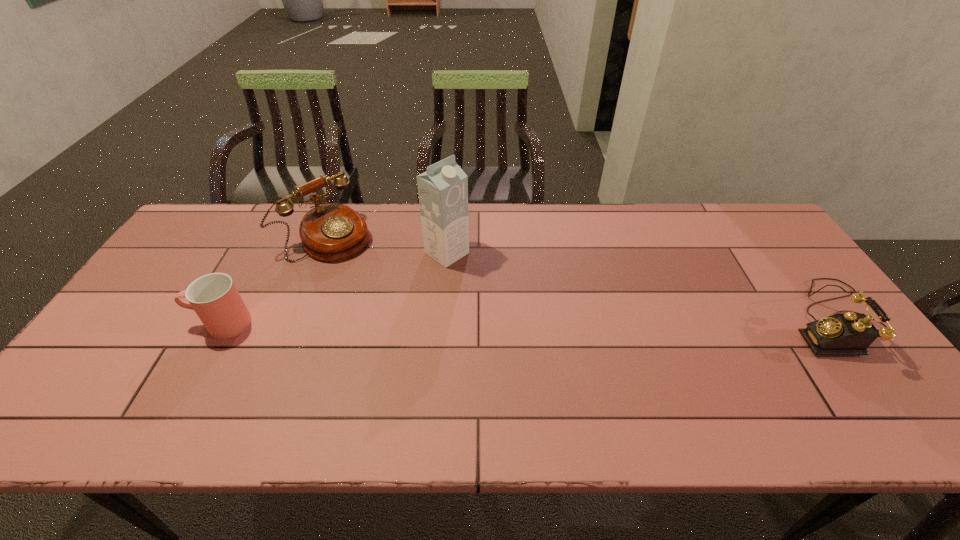
Where is `cup`? cup is located at coordinates (214, 297).

The height and width of the screenshot is (540, 960). In order to click on the nearer telephone in this screenshot , I will do `click(839, 334)`.

At what (x,y) coordinates should I click in order to perform the action: click on the shorter telephone. Please return your answer as a coordinate pair (x, y). Image resolution: width=960 pixels, height=540 pixels. Looking at the image, I should click on (839, 334).

In order to click on the left telephone in this screenshot , I will do `click(331, 232)`.

Locate an element on the screen. the farther telephone is located at coordinates (331, 232).

Where is `the third object from left to right`? This screenshot has height=540, width=960. the third object from left to right is located at coordinates (443, 189).

In order to click on the tallest object in this screenshot , I will do `click(443, 189)`.

The height and width of the screenshot is (540, 960). In order to click on blank space located 0.070m on the side of the cup with the handle in this screenshot , I will do `click(165, 323)`.

Find the location of a particular element. Image resolution: width=960 pixels, height=540 pixels. vacant area located 0.160m on the side of the cup with the handle is located at coordinates (131, 323).

Locate an element on the screen. This screenshot has height=540, width=960. free location located on the side of the cup with the handle is located at coordinates (169, 323).